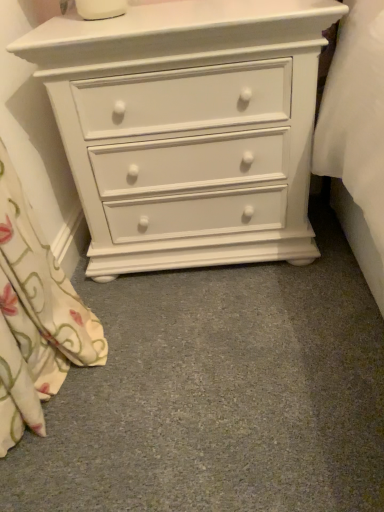
What is the approximate height of white matte chest of drawers at center?

The height of white matte chest of drawers at center is 25.95 inches.

Find the location of a particular element. The width and height of the screenshot is (384, 512). white matte chest of drawers at center is located at coordinates (188, 129).

This screenshot has height=512, width=384. Describe the element at coordinates (188, 129) in the screenshot. I see `white matte chest of drawers at center` at that location.

You are a GUI agent. You are given a task and a screenshot of the screen. Output one action in this format:
    pyautogui.click(x=<x>, y=<y>)
    Task: Click on the white matte chest of drawers at center
    The width and height of the screenshot is (384, 512).
    Given the screenshot: What is the action you would take?
    pyautogui.click(x=188, y=129)